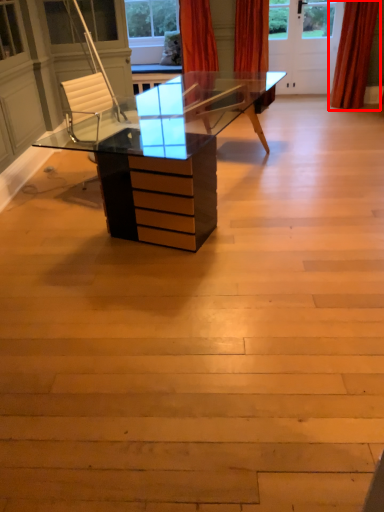
Question: From the image's perspective, what is the correct spatial positioning of curtain (annotated by the red box) in reference to curtain?

Choices:
 (A) above
 (B) below

Answer: (B)